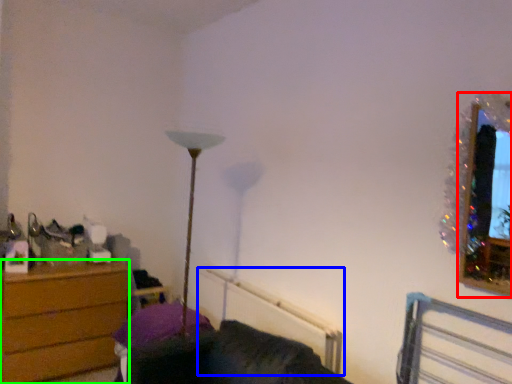
Question: Which object is positioned closest to picture frame (highlighted by a red box)? Select from radiator (highlighted by a blue box) and chest of drawers (highlighted by a green box).

Choices:
 (A) radiator
 (B) chest of drawers

Answer: (A)